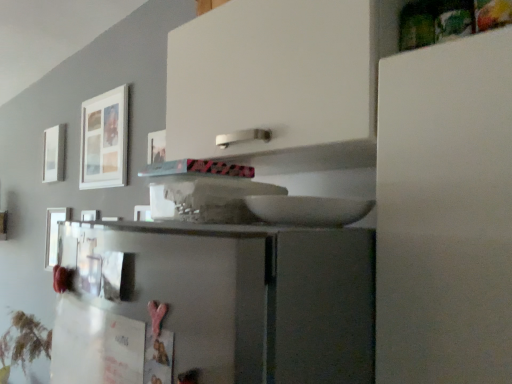
Question: Based on their positions, is white matte picture frame at upper left, arranged as the 3th picture frame when viewed from the right, located to the left or right of metallic silver picture frame at left, the second picture frame positioned from the front?

Choices:
 (A) left
 (B) right

Answer: (A)

Question: From the image's perspective, is white matte picture frame at upper left, arranged as the 3th picture frame when viewed from the right, located above or below metallic silver picture frame at left, acting as the 2th picture frame starting from the left?

Choices:
 (A) below
 (B) above

Answer: (B)

Question: Which object is positioned farthest from the white matte picture frame at upper left, arranged as the 3th picture frame when viewed from the right?

Choices:
 (A) white matte picture frame at upper left, which is counted as the 1th picture frame, starting from the right
 (B) metallic silver picture frame at left, the second picture frame positioned from the front

Answer: (A)

Question: Which is farther from the white matte picture frame at upper left, placed as the 1th picture frame when sorted from left to right?

Choices:
 (A) white matte picture frame at upper left, which is the first picture frame from front to back
 (B) metallic silver picture frame at left, the second picture frame positioned from the front

Answer: (A)